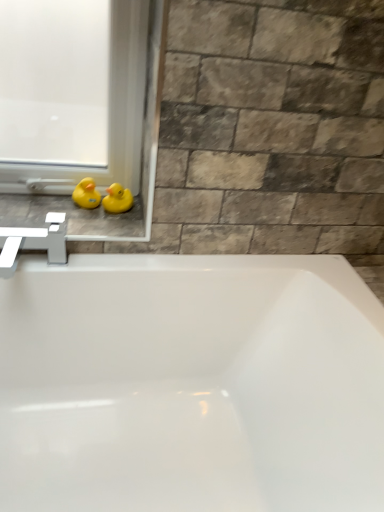
Locate an element on the screen. This screenshot has width=384, height=512. free space to the left of yellow rubber duck at upper left, the first duck positioned from the right is located at coordinates (49, 211).